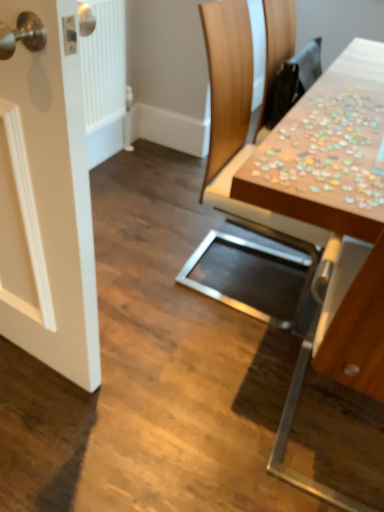
Identify the location of free space in front of wooden chair at upper right. (191, 350).